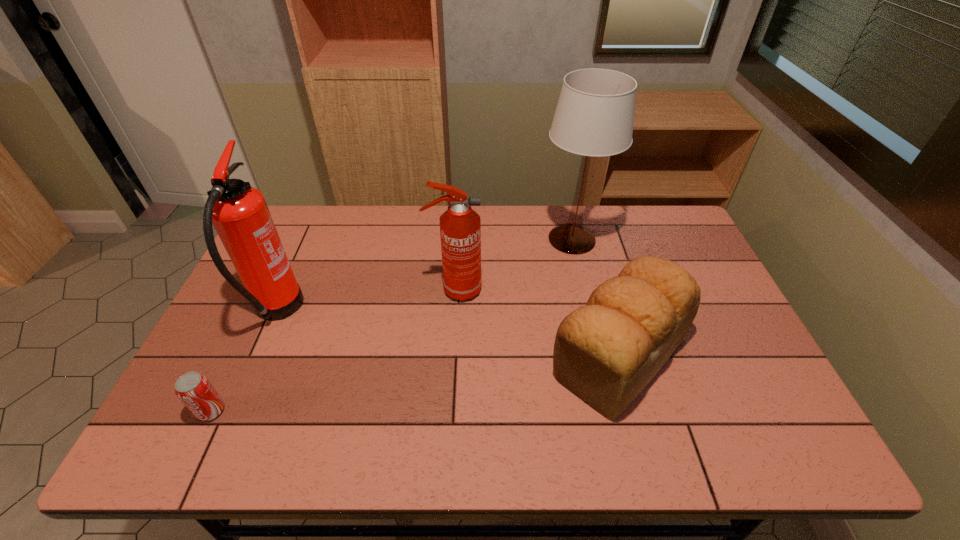
Image resolution: width=960 pixels, height=540 pixels. Find the location of `table lamp`. table lamp is located at coordinates (594, 116).

Identify the location of the left fire extinguisher. The height and width of the screenshot is (540, 960). (239, 213).

Locate an element on the screen. This screenshot has height=540, width=960. the third object from right to left is located at coordinates (460, 226).

At what (x,y) coordinates should I click in order to perform the action: click on the shorter fire extinguisher. Please return your answer as a coordinate pair (x, y). This screenshot has width=960, height=540. Looking at the image, I should click on (460, 226).

Where is `bread`? bread is located at coordinates [606, 352].

The height and width of the screenshot is (540, 960). What are the coordinates of `soda can` in the screenshot? It's located at (195, 391).

The width and height of the screenshot is (960, 540). Find the location of `blank space located 0.070m above the cylindrical shade of the table lamp`. blank space located 0.070m above the cylindrical shade of the table lamp is located at coordinates (516, 239).

The height and width of the screenshot is (540, 960). Identify the location of free space located 0.080m above the cylindrical shade of the table lamp. (514, 239).

Where is `free point located 0.150m above the cylindrical shade of the table lamp`? free point located 0.150m above the cylindrical shade of the table lamp is located at coordinates (493, 239).

This screenshot has height=540, width=960. Identify the location of free location located 0.400m at the nozzle of the left fire extinguisher. (441, 312).